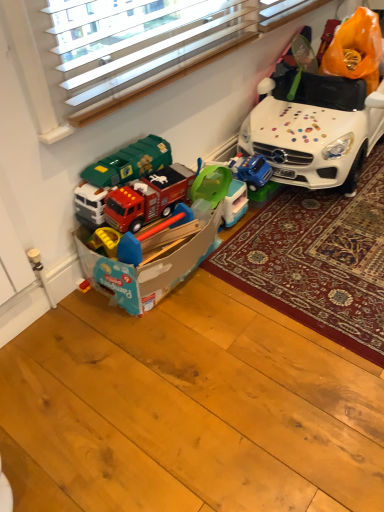
The image size is (384, 512). What are the coordinates of `vacant space to the right of green plastic toy at center, arranged as the 1th toy when viewed from the back` in the screenshot? It's located at (265, 219).